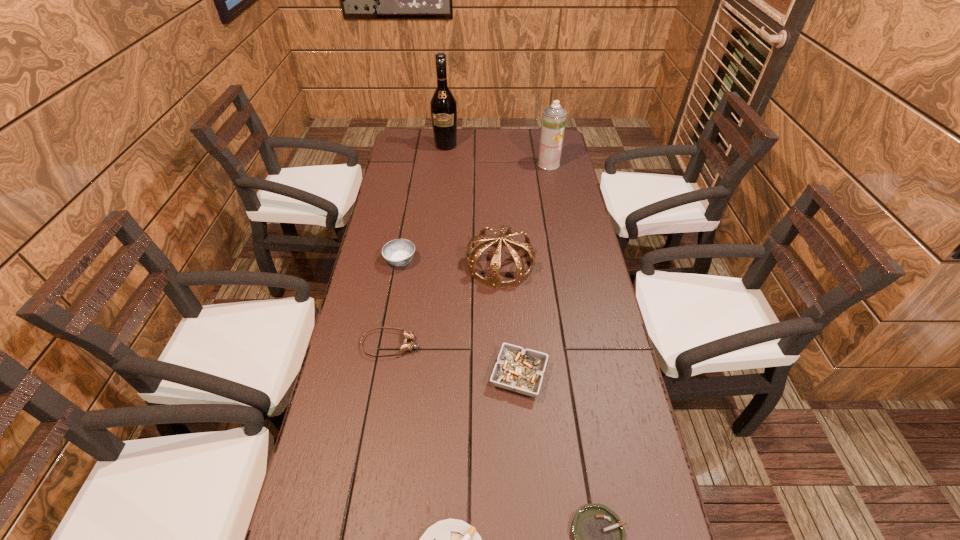
You are a GUI agent. You are given a task and a screenshot of the screen. Output one action in this format:
    pyautogui.click(x=<x>, y=<y>)
    Task: Click on the farthest object
    Image resolution: width=960 pixels, height=540 pixels.
    Given the screenshot: What is the action you would take?
    pyautogui.click(x=443, y=105)

Where is `wine bottle`? wine bottle is located at coordinates (443, 105).

You are a GUI agent. You are given a task and a screenshot of the screen. Output one action in this format:
    pyautogui.click(x=<x>, y=<y>)
    Task: Click on the second farthest object
    This screenshot has width=960, height=540.
    Given the screenshot: What is the action you would take?
    pyautogui.click(x=554, y=117)

I want to click on aerosol can, so click(x=554, y=117).

I want to click on the third tallest object, so pyautogui.click(x=493, y=279).

Image resolution: width=960 pixels, height=540 pixels. I want to click on the leftmost ashtray, so click(x=399, y=252).

Find the location of a particular element. the farthest ashtray is located at coordinates (399, 252).

Locate an element on the screen. Image resolution: width=960 pixels, height=540 pixels. the second farthest ashtray is located at coordinates (520, 370).

Image resolution: width=960 pixels, height=540 pixels. Find the location of `the second shortest object`. the second shortest object is located at coordinates (406, 346).

Locate an element on the screen. free location located 0.250m on the label of the wine bottle is located at coordinates (442, 185).